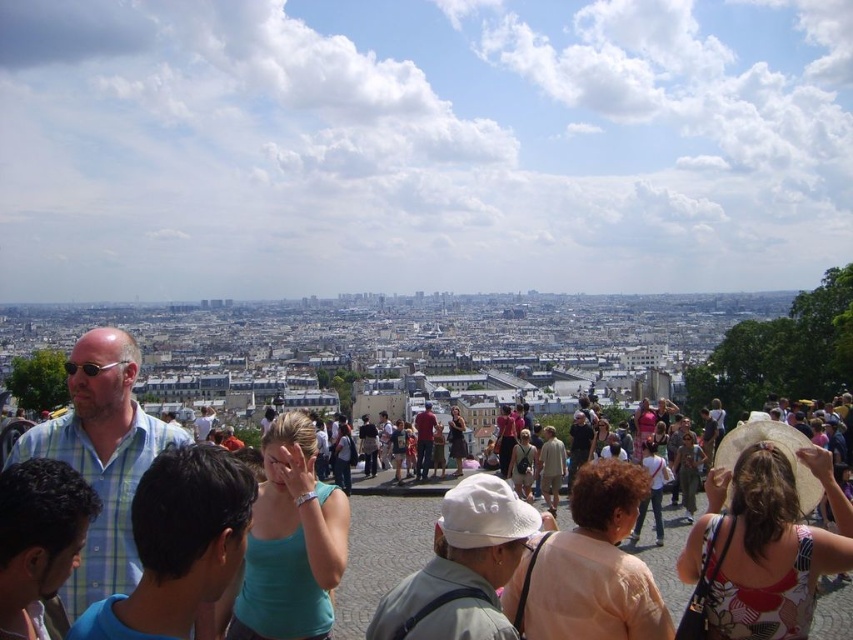
You are a tourist standing on Montmartre hill in Paris, France. You see a person wearing a green plaid shirt at left and another wearing a matte beige hat at center. Which person is positioned more to your left side?

The green plaid shirt at left is positioned to the left of the matte beige hat at center, so the person wearing the green plaid shirt at left is more to your left side.

From the picture: You are a photographer standing in the crowd on Montmartre hill and notice a printed fabric hat at center and a teal fabric tank top at center. Which object is closer to you?

The printed fabric hat at center is closer to you because it is further to the viewer than the teal fabric tank top at center.

You are a photographer standing at the edge of Montmartre, aiming to capture the entire cityscape in your shot. However, there is a beige cotton hat at center in the frame. Based on its coordinates, will the hat obstruct your view of the cityscape?

The beige cotton hat at center is located at coordinates point (550, 467), which is within the central area of the frame. Since the cityscape dominates the midground and background, the hat might partially obstruct the view directly behind it but won